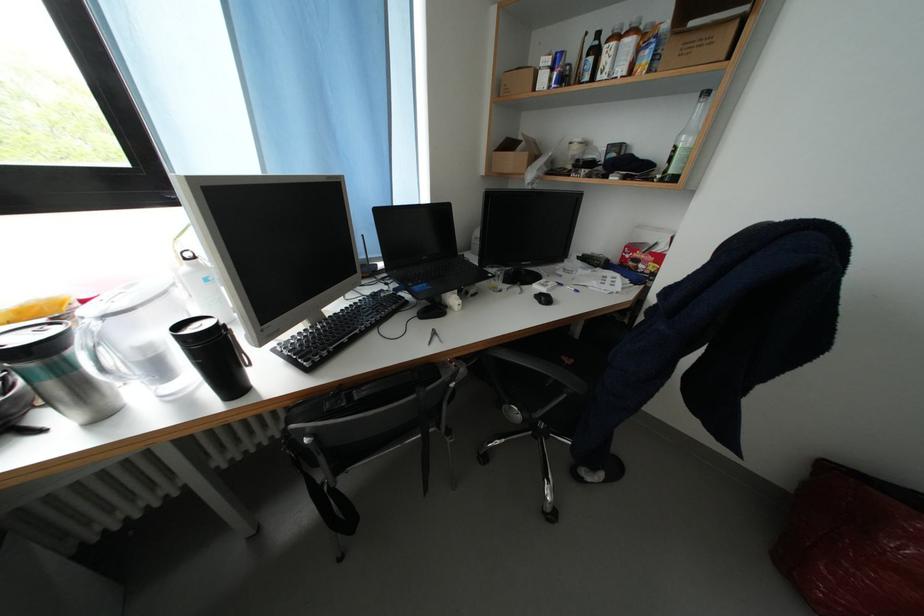
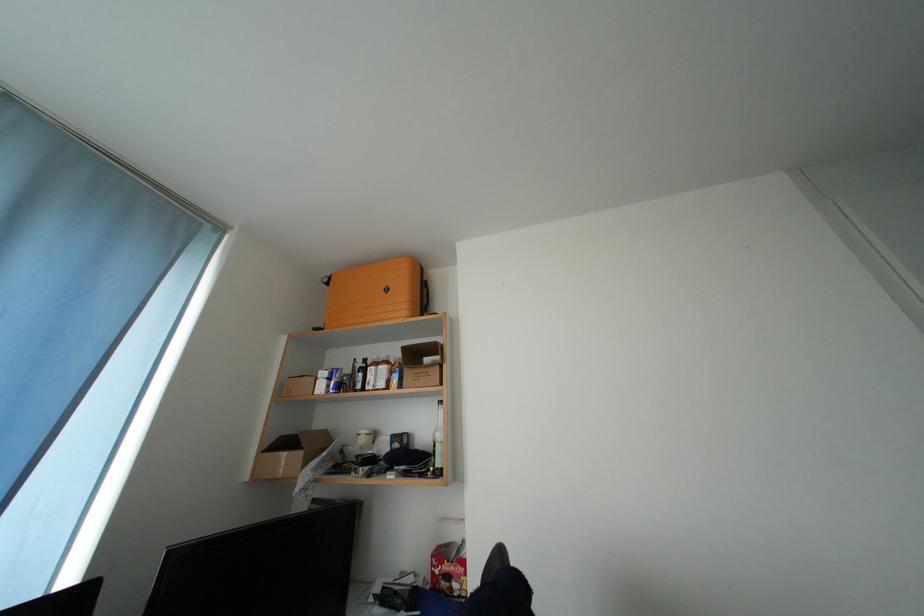
First-person continuous shooting, in which direction is the camera rotating?

The rotation direction of the camera is right-up.